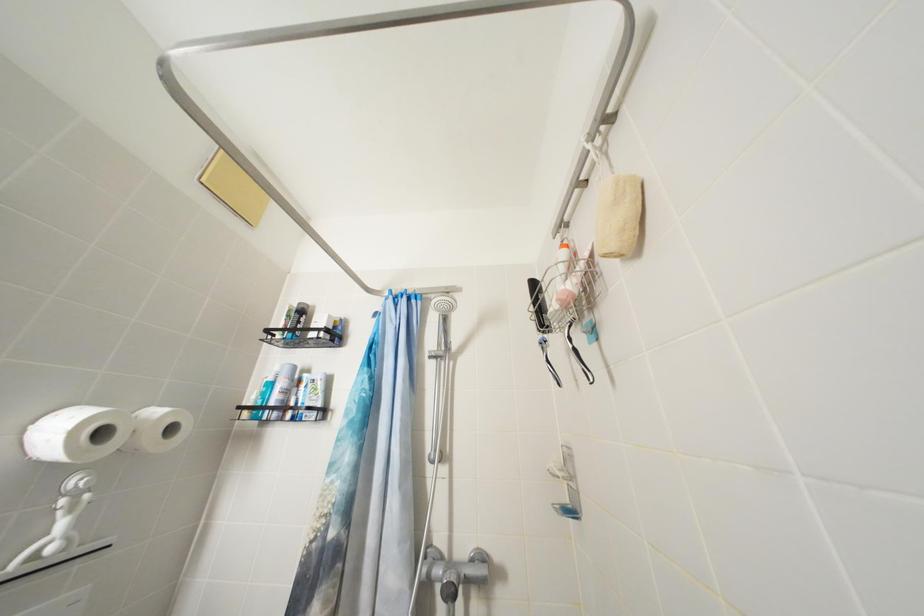
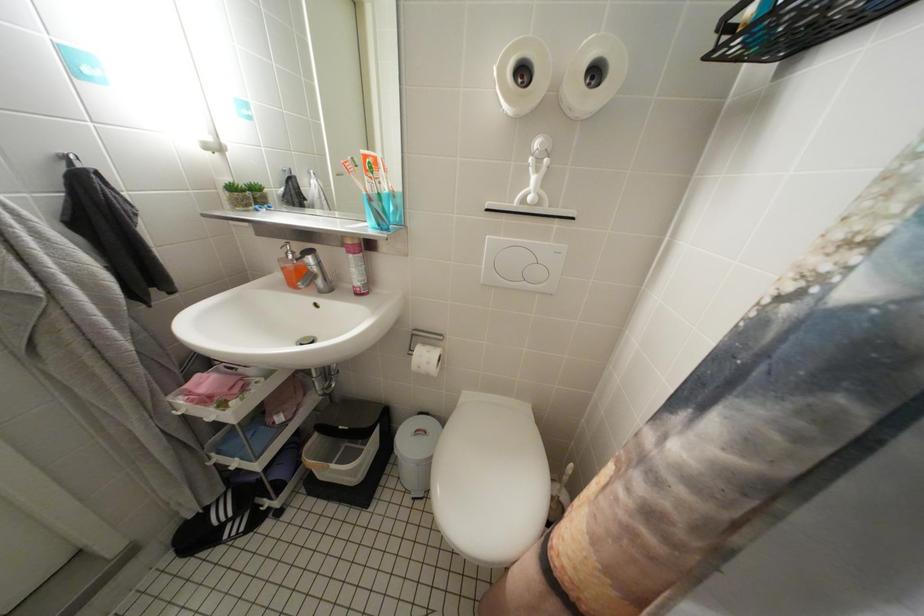
The first image is from the beginning of the video and the second image is from the end. How did the camera likely rotate when shooting the video?

The camera rotated toward left-down.